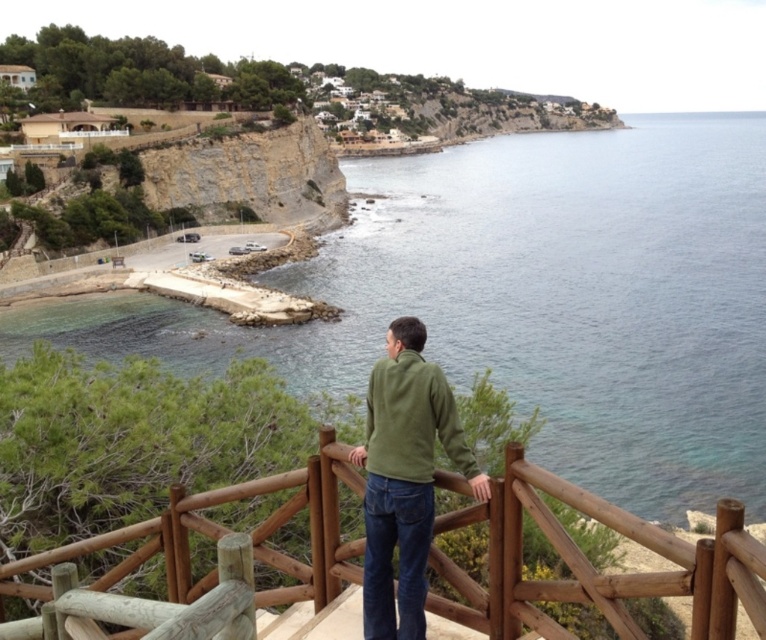
Does wooden at center come behind green fleece jacket at center?

No, it is not.

Consider the image. Is wooden at center positioned before green fleece jacket at center?

Yes, it is.

Which is in front, point (627, 627) or point (421, 497)?

Positioned in front is point (627, 627).

Find the location of a particular element. The image size is (766, 640). wooden at center is located at coordinates (591, 564).

How far apart are green fleece jacket at center and green fleece sweatshirt at center?

The distance of green fleece jacket at center from green fleece sweatshirt at center is 21.31 inches.

Between green fleece jacket at center and green fleece sweatshirt at center, which one appears on the left side from the viewer's perspective?

green fleece jacket at center is more to the left.

I want to click on green fleece jacket at center, so click(404, 477).

Find the location of a particular element. green fleece jacket at center is located at coordinates (404, 477).

Who is more forward, (329, 525) or (470, 476)?

Point (470, 476)

Does wooden at center appear over green fleece sweatshirt at center?

No.

Who is more forward, (326,428) or (439,410)?

Point (439,410) is more forward.

Find the location of a particular element. wooden at center is located at coordinates (591, 564).